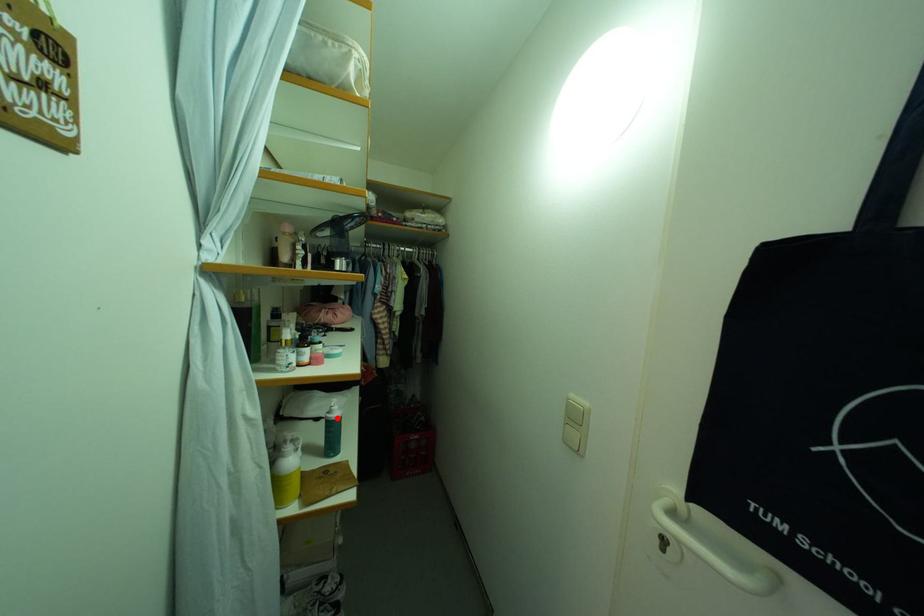
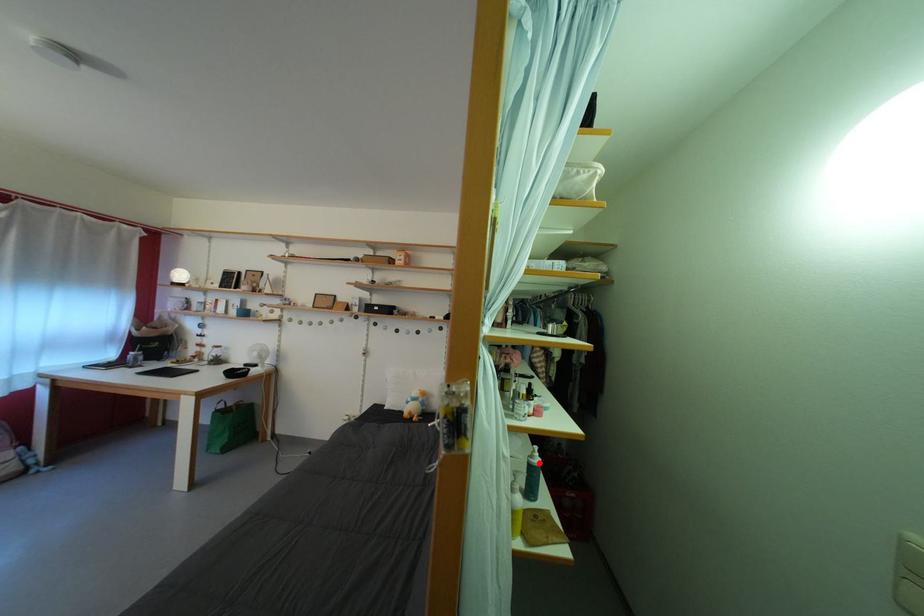
I am providing you with two images of the same scene from different viewpoints. A red point is marked on the first image and another point is marked on the second image. Is the red point in image1 aligned with the point shown in image2?

Yes